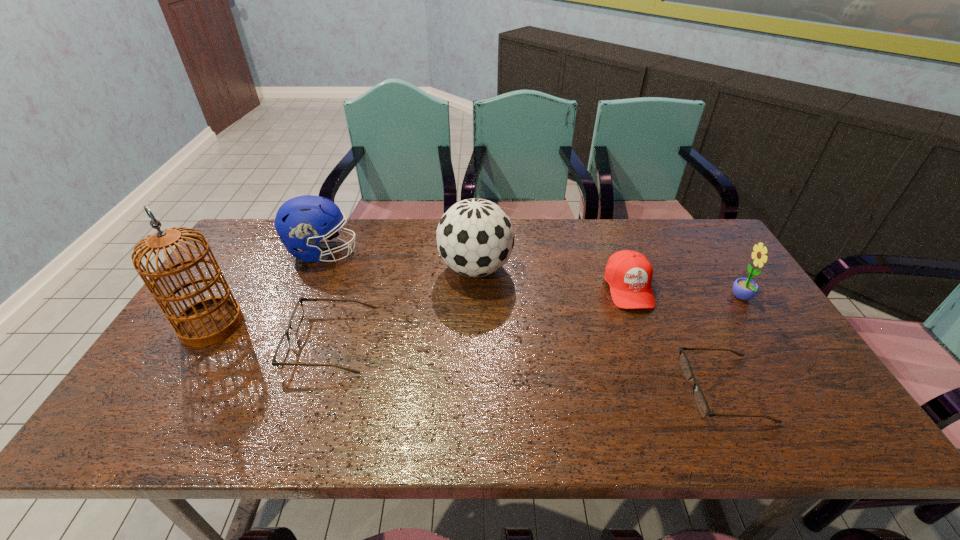
The width and height of the screenshot is (960, 540). What are the coordinates of `the left spectacles` in the screenshot? It's located at (281, 352).

Identify the location of the second shortest object. This screenshot has height=540, width=960. (281, 352).

Locate an element on the screen. The width and height of the screenshot is (960, 540). the shorter spectacles is located at coordinates (699, 398).

This screenshot has width=960, height=540. I want to click on the right spectacles, so [699, 398].

Locate an element on the screen. The width and height of the screenshot is (960, 540). the fourth object from left to right is located at coordinates (475, 237).

Where is `football helmet`? The image size is (960, 540). football helmet is located at coordinates (301, 222).

The height and width of the screenshot is (540, 960). I want to click on the fifth tallest object, so click(629, 274).

Identify the location of the leftmost object. The height and width of the screenshot is (540, 960). (210, 320).

Identify the location of the tallest object. (210, 320).

Find the location of a particular element. This screenshot has width=960, height=540. sunflower is located at coordinates (743, 288).